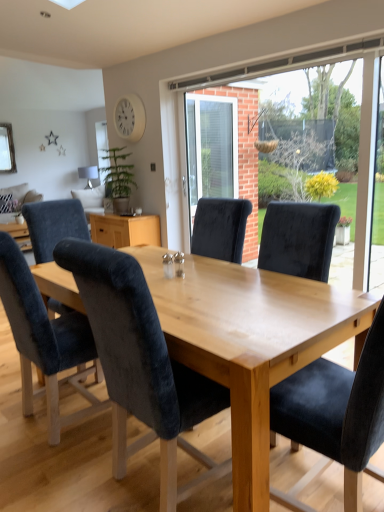
Question: Looking at their shapes, would you say matte silver lamp at upper left is wider or thinner than velvet black chair at center, placed as the first chair when sorted from front to back?

Choices:
 (A) wide
 (B) thin

Answer: (B)

Question: From a real-world perspective, is matte silver lamp at upper left above or below velvet black chair at center, placed as the first chair when sorted from front to back?

Choices:
 (A) above
 (B) below

Answer: (A)

Question: Estimate the real-world distances between objects in this image. Which object is farther from the white matte clock at upper center?

Choices:
 (A) velvet blue chair at center, acting as the first chair starting from the back
 (B) matte silver lamp at upper left
 (C) velvet dark blue chair at lower left, arranged as the third chair when viewed from the front
 (D) velvet dark blue chair at center, which is counted as the 2th chair, starting from the front
 (E) velvet blue couch at left

Answer: (D)

Question: Which object is the closest to the velvet blue pillow at left?

Choices:
 (A) transparent glass window at center
 (B) matte silver lamp at upper left
 (C) white matte clock at upper center
 (D) velvet blue chair at center, arranged as the first chair when viewed from the left
 (E) velvet black chair at center, the fourth chair positioned from the back

Answer: (D)